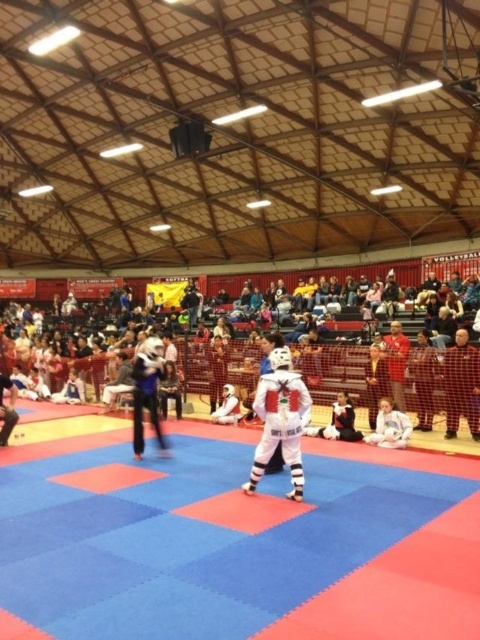
Does point (85, 362) come in front of point (262, 435)?

No, (85, 362) is further to viewer.

This screenshot has height=640, width=480. Find the location of `white fabric crowd at center`. white fabric crowd at center is located at coordinates [x=385, y=378].

Which is behind, point (195, 368) or point (250, 484)?

The point (195, 368) is behind.

Image resolution: width=480 pixels, height=640 pixels. Find the location of `white fabric crowd at center`. white fabric crowd at center is located at coordinates (385, 378).

Based on the photo, who is positioned more to the right, white matte karate uniform at center or white matte karate gi at center?

From the viewer's perspective, white matte karate gi at center appears more on the right side.

Who is lower down, white matte karate uniform at center or white matte karate gi at center?

white matte karate gi at center is lower down.

Locate an element on the screen. white matte karate uniform at center is located at coordinates (279, 420).

At what (x,y) coordinates should I click in order to perform the action: click on white matte karate uniform at center. Please return your answer as a coordinate pair (x, y). This screenshot has height=640, width=480. Looking at the image, I should click on (279, 420).

Does white fabric crowd at center lie behind white matte karate gi at center?

That is True.

Which is below, white fabric crowd at center or white matte karate gi at center?

white matte karate gi at center is lower down.

Is point (345, 348) positioned after point (372, 435)?

Yes, it is behind point (372, 435).

Find the location of a particular element. white fabric crowd at center is located at coordinates (385, 378).